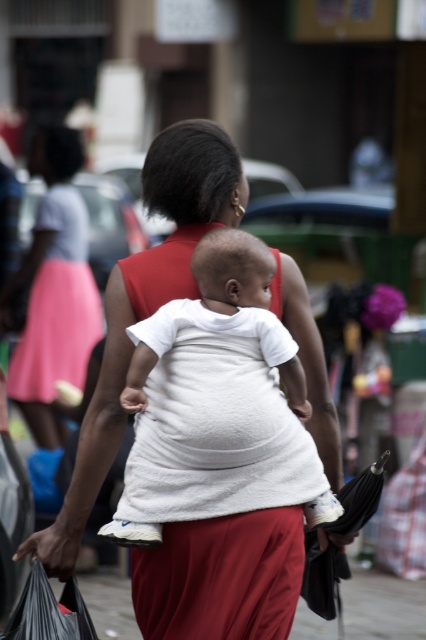
In the scene shown: Which of these two, white soft fabric baby at center or pink fabric skirt at left, stands shorter?

white soft fabric baby at center is shorter.

Between point (213, 400) and point (68, 314), which one is positioned behind?

Positioned behind is point (68, 314).

Find the location of a particular element. Image resolution: width=426 pixels, height=640 pixels. white soft fabric baby at center is located at coordinates (216, 394).

Does white matte shirt at center have a larger size compared to white soft fabric baby at center?

Correct, white matte shirt at center is larger in size than white soft fabric baby at center.

Is white matte shirt at center positioned before white soft fabric baby at center?

That is False.

Who is more distant from viewer, (149, 593) or (238, 397)?

Point (149, 593)

The image size is (426, 640). Find the location of `white matte shirt at center`. white matte shirt at center is located at coordinates (144, 305).

Can you confirm if white matte shirt at center is taller than pink fabric skirt at left?

No, white matte shirt at center is not taller than pink fabric skirt at left.

Is point (140, 276) positioned after point (62, 244)?

No, it is in front of (62, 244).

Who is more forward, (152, 276) or (86, 241)?

Positioned in front is point (152, 276).

Image resolution: width=426 pixels, height=640 pixels. Identify the location of white matte shirt at center. (144, 305).